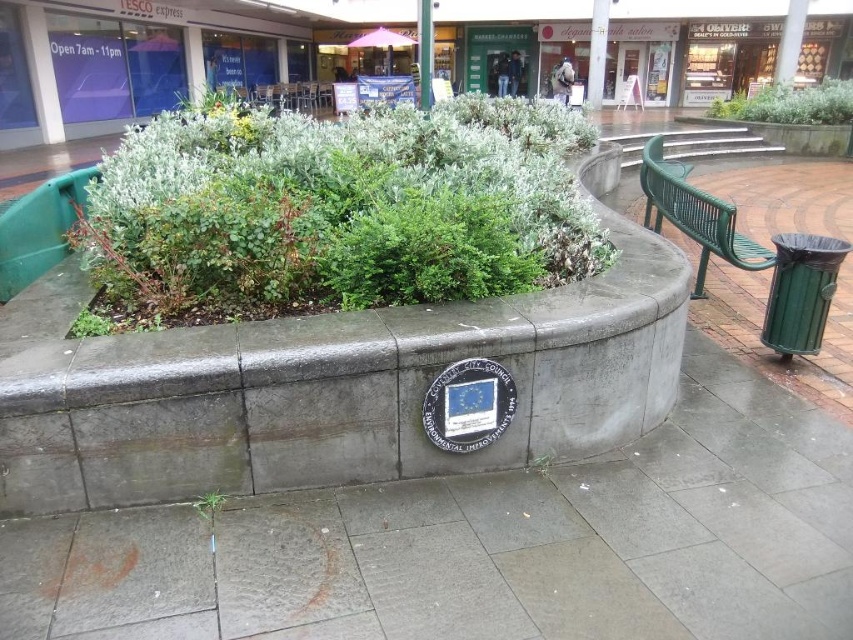
Question: Which object appears farthest from the camera in this image?

Choices:
 (A) green metal bench at right
 (B) green leafy bush at upper center

Answer: (B)

Question: Which object is closer to the camera taking this photo?

Choices:
 (A) green leafy bush at upper center
 (B) green metal bench at right

Answer: (B)

Question: Does green leafy bush at upper center appear on the left side of green leafy plant at center?

Choices:
 (A) yes
 (B) no

Answer: (B)

Question: Among these points, which one is farthest from the camera?

Choices:
 (A) (785, 624)
 (B) (378, 268)
 (C) (68, 330)
 (D) (209, 513)

Answer: (B)

Question: Does gray concrete pavement at center have a larger size compared to green leafy plant at center?

Choices:
 (A) yes
 (B) no

Answer: (A)

Question: Can you confirm if gray concrete pavement at center is positioned above green leafy bush at upper center?

Choices:
 (A) no
 (B) yes

Answer: (A)